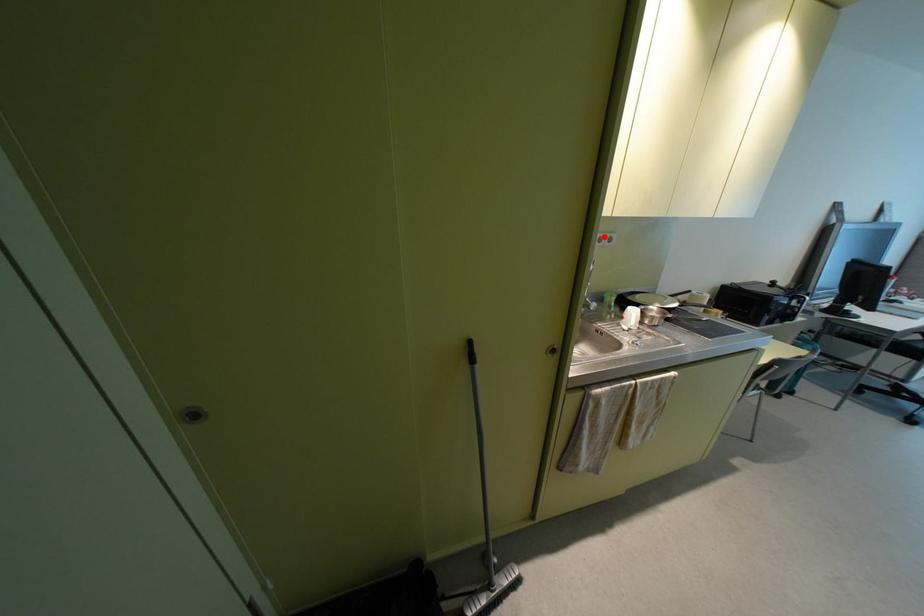
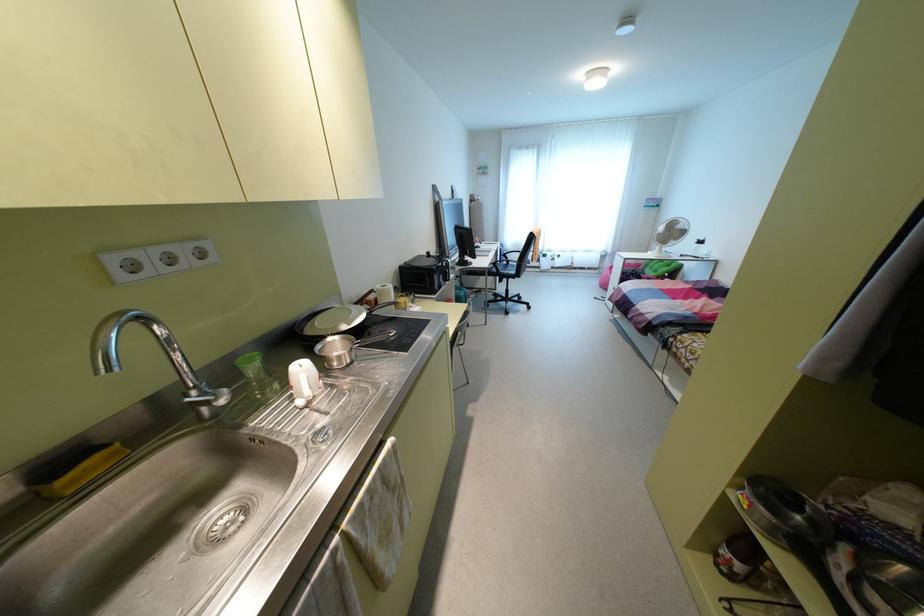
Where in the second image is the point corresponding to the highlighted location from the first image?

(181, 251)